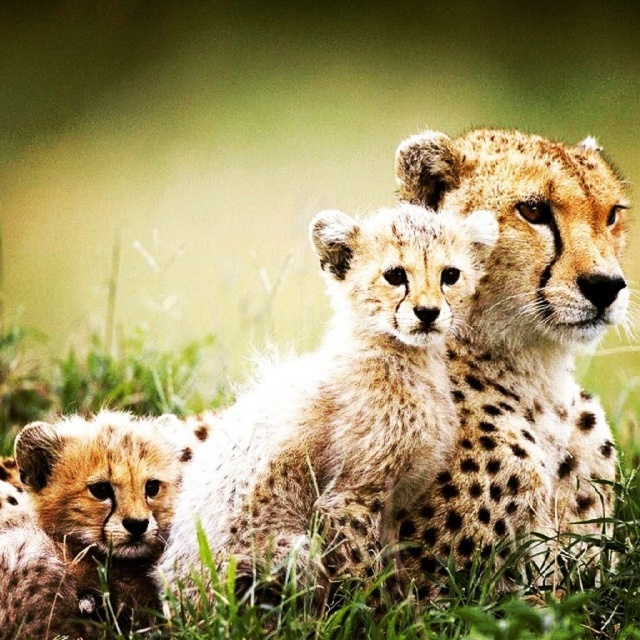
Consider the image. Does spotted fur cub at center have a larger size compared to spotted fur cheetah at upper center?

Yes, spotted fur cub at center is bigger than spotted fur cheetah at upper center.

Which is in front, point (259, 513) or point (520, 148)?

Positioned in front is point (259, 513).

Between point (253, 403) and point (500, 237), which one is positioned behind?

Positioned behind is point (500, 237).

I want to click on spotted fur cub at center, so click(340, 404).